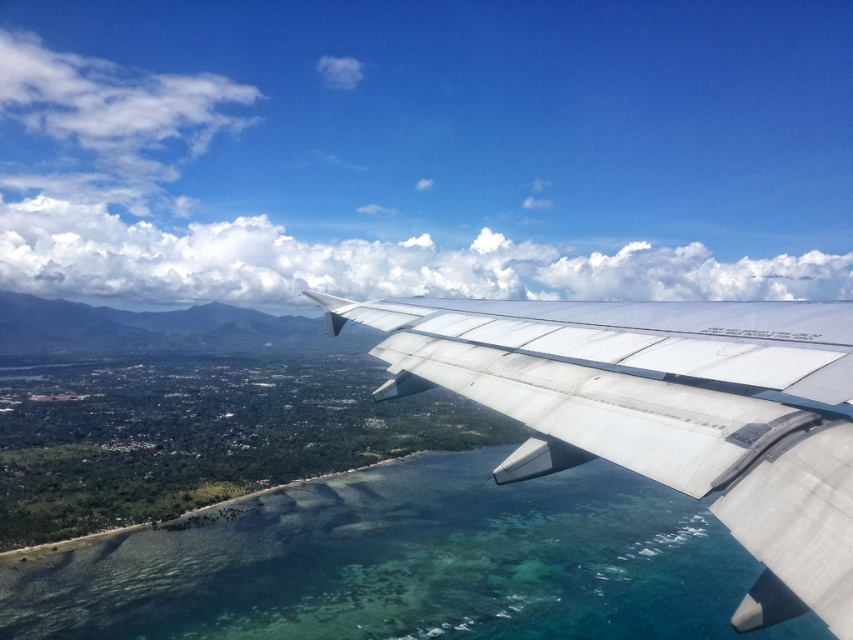
Who is lower down, clear blue water at lower center or silver metallic wing at center?

clear blue water at lower center

Does clear blue water at lower center appear on the left side of silver metallic wing at center?

Incorrect, clear blue water at lower center is not on the left side of silver metallic wing at center.

Does point (752, 560) lie behind point (791, 540)?

Yes, point (752, 560) is behind point (791, 540).

Identify the location of clear blue water at lower center. The width and height of the screenshot is (853, 640). (410, 563).